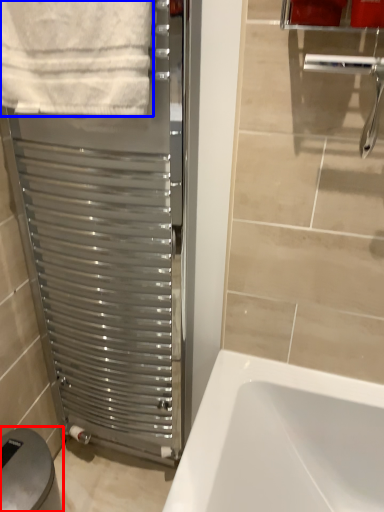
Question: Which point is closer to the camera, gray (highlighted by a red box) or towel (highlighted by a blue box)?

Choices:
 (A) gray
 (B) towel

Answer: (B)